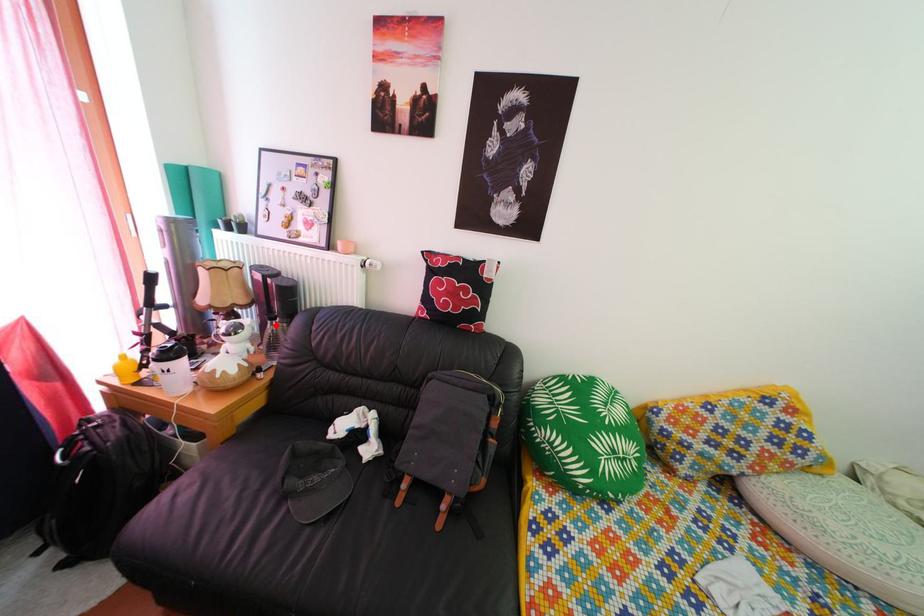
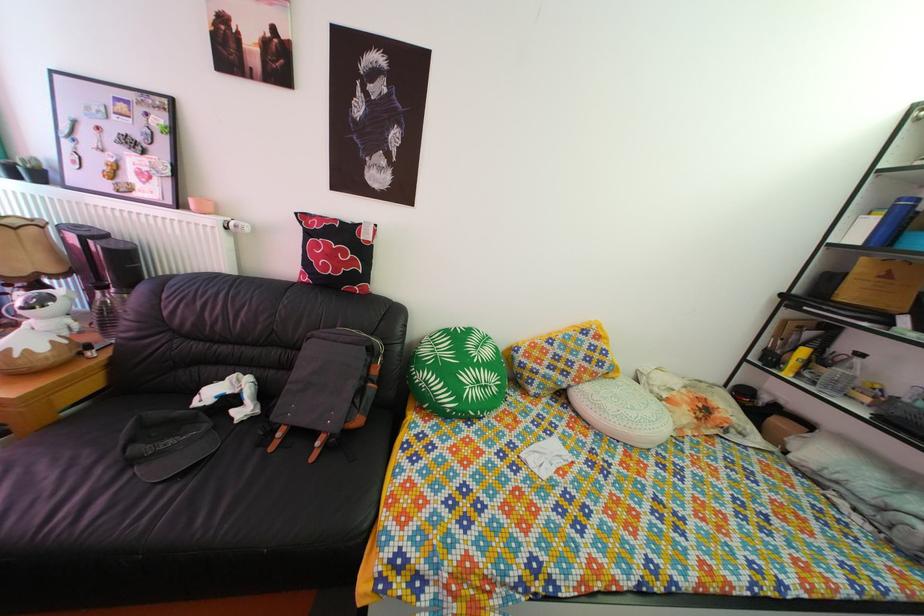
Where in the second image is the point corresponding to the highlighted location from the first image?

(103, 294)